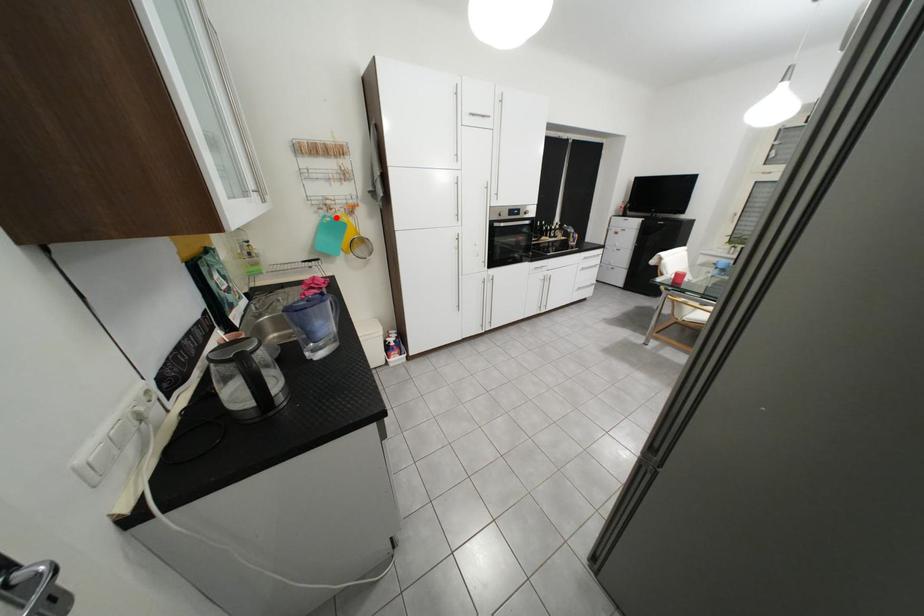
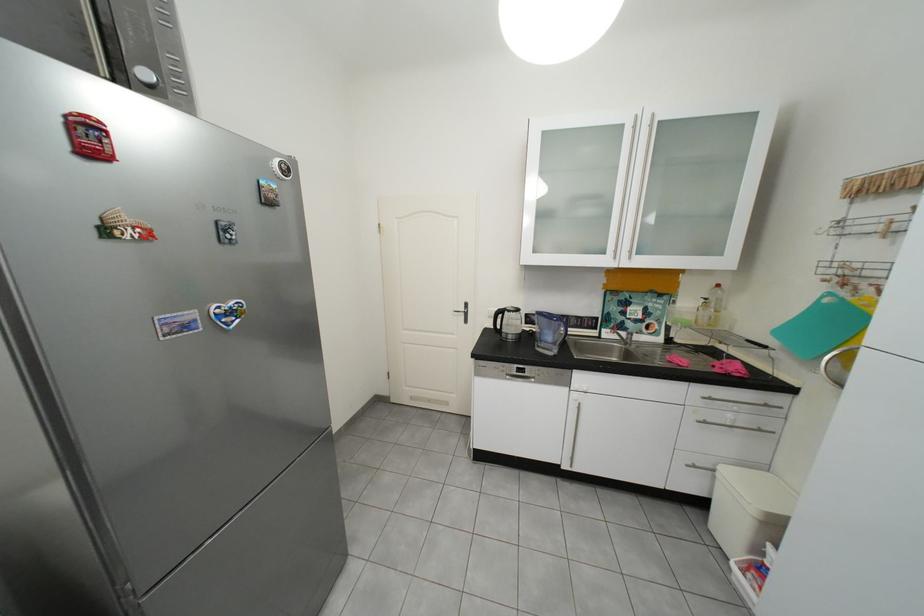
Find the pixel in the second image that matches the highlighted location in the first image.

(841, 296)